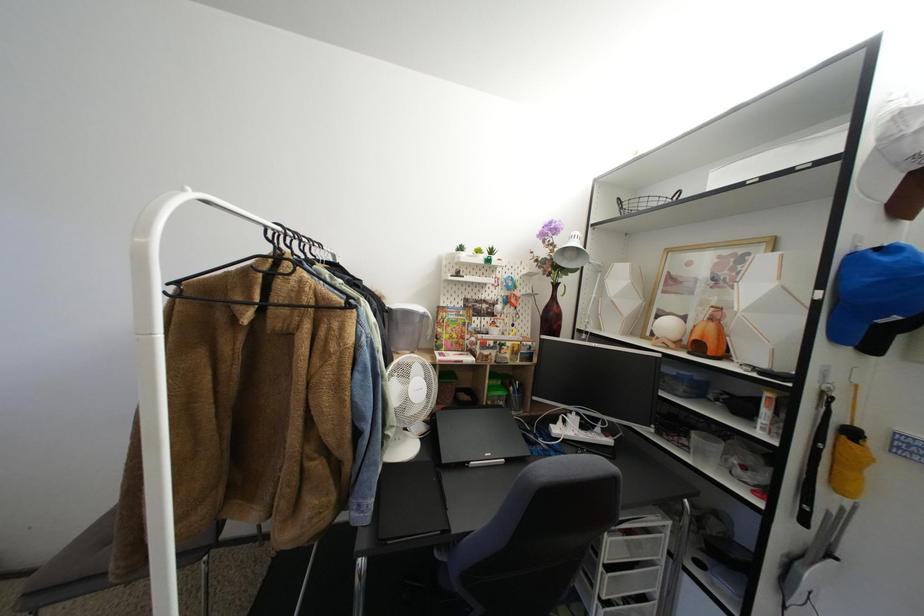
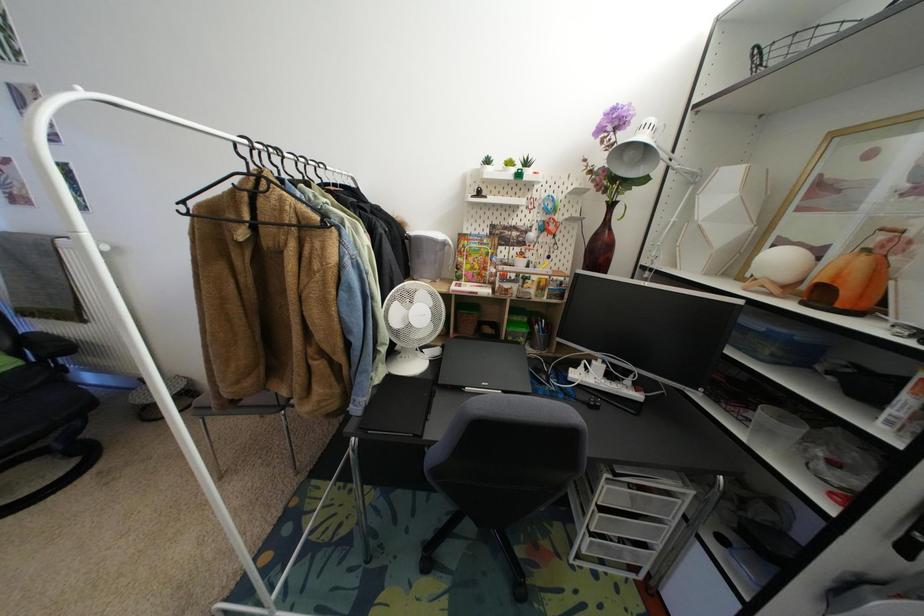
Which direction would the cameraman need to move to produce the second image?

The cameraman moved toward right, forward.